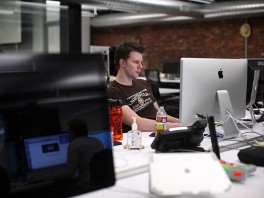
Identify the location of bottle of water. (162, 116).